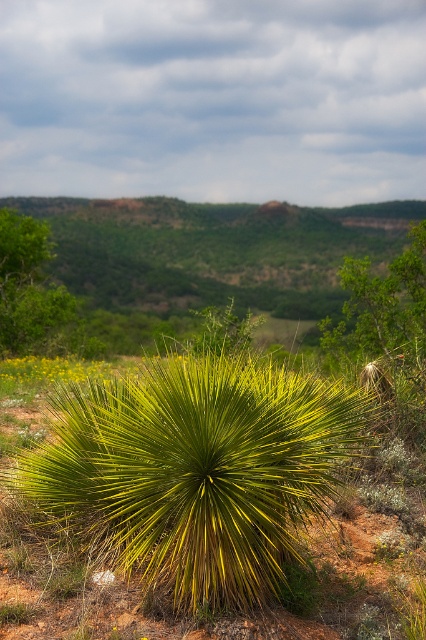
You are standing at the edge of a desert and see the green spiky plant at center and the green leafy tree at center. Which one is closer to you?

The green spiky plant at center is closer to you because it is only 10.99 meters away from the green leafy tree at center, implying it is nearer than the tree.

You are standing in a garden and want to water the green spiky plant at center. If your watering can has a maximum reach of 4 meters, can you water it without moving closer?

The green spiky plant at center is 4.45 meters away from the viewer. Since the watering can only reaches up to 4 meters, you cannot water it without moving closer.

In the scene shown: You are standing in the natural landscape and want to water the green spiky plant at center and the green leafy tree at center. Since you have limited water, which plant should you prioritize watering based on their current positions?

The green spiky plant at center is positioned under the green leafy tree at center, so it may receive less sunlight and water naturally. Prioritize watering the green spiky plant at center first.